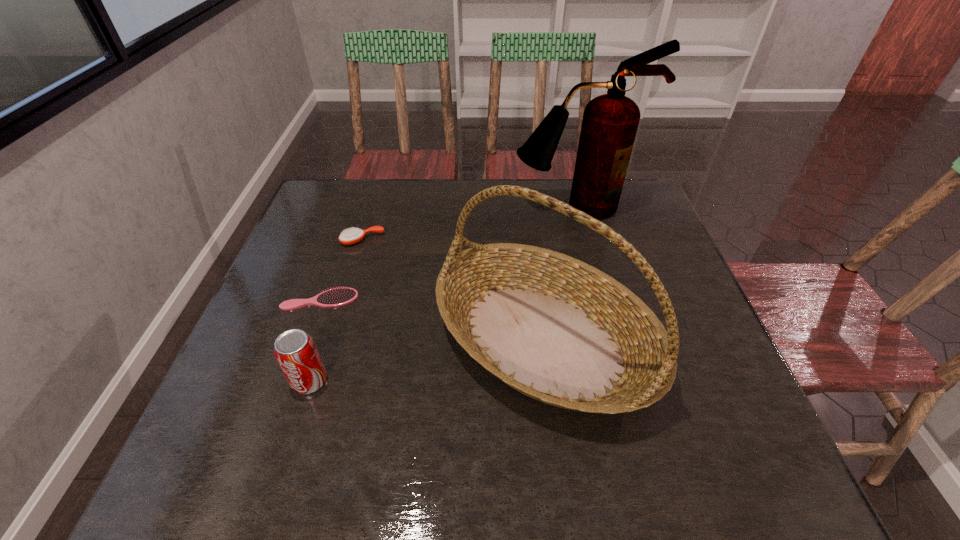
This screenshot has height=540, width=960. Identify the location of free space between the shortest object and the basket. (432, 319).

The width and height of the screenshot is (960, 540). Find the location of `empty space that is in between the farther hairbrush and the nearer hairbrush`. empty space that is in between the farther hairbrush and the nearer hairbrush is located at coordinates (342, 269).

Where is `free space between the taller hairbrush and the third shortest object`? The height and width of the screenshot is (540, 960). free space between the taller hairbrush and the third shortest object is located at coordinates (336, 310).

The height and width of the screenshot is (540, 960). What are the coordinates of `object that is the second closest to the fourth tallest object` in the screenshot? It's located at (558, 330).

Identify the location of object that stands as the second closest to the basket. (336, 297).

The image size is (960, 540). I want to click on vacant space that satisfies the following two spatial constraints: 1. on the back side of the third shortest object; 2. on the left side of the basket, so click(x=323, y=339).